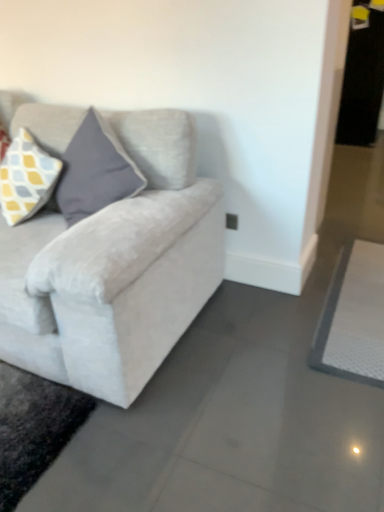
Find the location of a particular element. empty space that is ontop of white textured yoga mat at lower right (from a real-world perspective) is located at coordinates (362, 293).